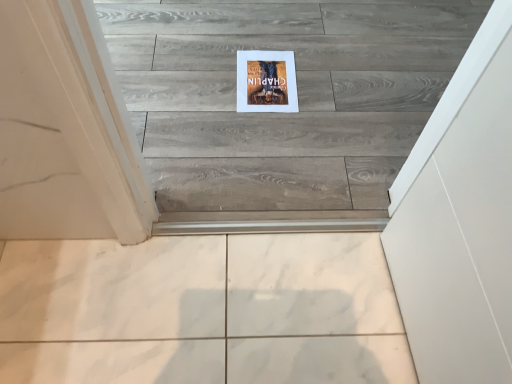
Describe the element at coordinates (266, 81) in the screenshot. Image resolution: width=512 pixels, height=384 pixels. I see `matte cardboard poster at center` at that location.

What is the approximate width of matte cardboard poster at center?

It is 12.03 inches.

Identify the location of matte cardboard poster at center. The height and width of the screenshot is (384, 512). (266, 81).

You are a GUI agent. You are given a task and a screenshot of the screen. Output one action in this format:
    pyautogui.click(x=<x>, y=<y>)
    Task: Click on the white marble tile at lower center
    The height and width of the screenshot is (384, 512).
    Given the screenshot: What is the action you would take?
    pyautogui.click(x=201, y=311)

The image size is (512, 384). Describe the element at coordinates (201, 311) in the screenshot. I see `white marble tile at lower center` at that location.

Find the location of a particular element. The image size is (512, 384). matte cardboard poster at center is located at coordinates (266, 81).

Considering the positions of objects white marble tile at lower center and matte cardboard poster at center in the image provided, who is more to the right, white marble tile at lower center or matte cardboard poster at center?

From the viewer's perspective, matte cardboard poster at center appears more on the right side.

Is the depth of white marble tile at lower center less than that of matte cardboard poster at center?

Yes, white marble tile at lower center is in front of matte cardboard poster at center.

Which is in front, point (321, 334) or point (281, 100)?

The point (321, 334) is more forward.

From the image's perspective, relative to matte cardboard poster at center, is white marble tile at lower center above or below?

Based on their image positions, white marble tile at lower center is located beneath matte cardboard poster at center.

From a real-world perspective, is white marble tile at lower center located beneath matte cardboard poster at center?

Yes, from a real-world perspective, white marble tile at lower center is beneath matte cardboard poster at center.

Considering the relative sizes of white marble tile at lower center and matte cardboard poster at center in the image provided, is white marble tile at lower center wider than matte cardboard poster at center?

Correct, the width of white marble tile at lower center exceeds that of matte cardboard poster at center.

Is white marble tile at lower center taller than matte cardboard poster at center?

Yes.

Considering the relative sizes of white marble tile at lower center and matte cardboard poster at center in the image provided, is white marble tile at lower center bigger than matte cardboard poster at center?

Indeed, white marble tile at lower center has a larger size compared to matte cardboard poster at center.

Do you think white marble tile at lower center is within matte cardboard poster at center, or outside of it?

white marble tile at lower center exists outside the volume of matte cardboard poster at center.

Is white marble tile at lower center positioned far away from matte cardboard poster at center?

No, white marble tile at lower center is not far away from matte cardboard poster at center.

Could you tell me if white marble tile at lower center is turned towards matte cardboard poster at center?

Yes, white marble tile at lower center faces towards matte cardboard poster at center.

Can you tell me how much white marble tile at lower center and matte cardboard poster at center differ in facing direction?

The angular difference between white marble tile at lower center and matte cardboard poster at center is 178 degrees.

I want to click on ceramic tile below the matte cardboard poster at center (from the image's perspective), so click(x=201, y=311).

Does matte cardboard poster at center appear on the left side of white marble tile at lower center?

Incorrect, matte cardboard poster at center is not on the left side of white marble tile at lower center.

Is matte cardboard poster at center behind white marble tile at lower center?

Yes, it is behind white marble tile at lower center.

Is point (254, 108) closer to viewer compared to point (114, 352)?

No, (254, 108) is behind (114, 352).

From the image's perspective, is matte cardboard poster at center on top of white marble tile at lower center?

Correct, matte cardboard poster at center appears higher than white marble tile at lower center in the image.

From a real-world perspective, which is physically below, matte cardboard poster at center or white marble tile at lower center?

From a 3D spatial view, white marble tile at lower center is below.

Is matte cardboard poster at center wider or thinner than white marble tile at lower center?

Clearly, matte cardboard poster at center has less width compared to white marble tile at lower center.

Which of these two, matte cardboard poster at center or white marble tile at lower center, stands taller?

With more height is white marble tile at lower center.

Does matte cardboard poster at center have a smaller size compared to white marble tile at lower center?

Yes.

Choose the correct answer: Is matte cardboard poster at center inside white marble tile at lower center or outside it?

matte cardboard poster at center is outside white marble tile at lower center.

Is matte cardboard poster at center not close to white marble tile at lower center?

No, matte cardboard poster at center is in close proximity to white marble tile at lower center.

Is matte cardboard poster at center aimed at white marble tile at lower center?

Yes, matte cardboard poster at center is facing white marble tile at lower center.

How many degrees apart are the facing directions of matte cardboard poster at center and white marble tile at lower center?

matte cardboard poster at center and white marble tile at lower center are facing 178 degrees away from each other.

The image size is (512, 384). I want to click on ceramic tile beneath the matte cardboard poster at center (from a real-world perspective), so click(201, 311).

Locate an element on the screen. The height and width of the screenshot is (384, 512). ceramic tile below the matte cardboard poster at center (from a real-world perspective) is located at coordinates (201, 311).

Where is `postcard above the white marble tile at lower center (from the image's perspective)`? postcard above the white marble tile at lower center (from the image's perspective) is located at coordinates tap(266, 81).